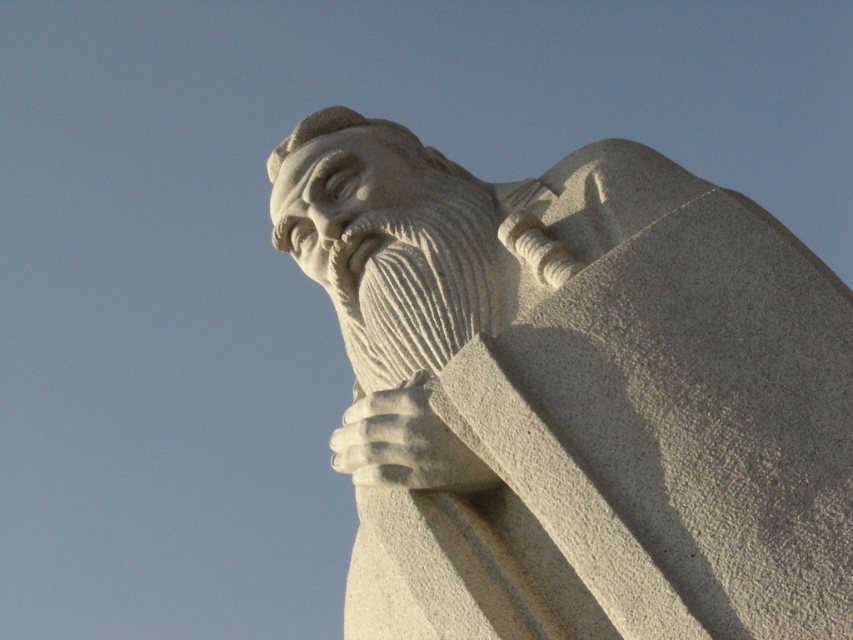
Question: Which object is farther from the camera taking this photo?

Choices:
 (A) white stone statue at center
 (B) white stone hand at center

Answer: (B)

Question: Can you confirm if white stone statue at center is wider than white stone hand at center?

Choices:
 (A) yes
 (B) no

Answer: (A)

Question: Is white stone statue at center bigger than white stone hand at center?

Choices:
 (A) no
 (B) yes

Answer: (B)

Question: Does white stone statue at center have a smaller size compared to white stone hand at center?

Choices:
 (A) no
 (B) yes

Answer: (A)